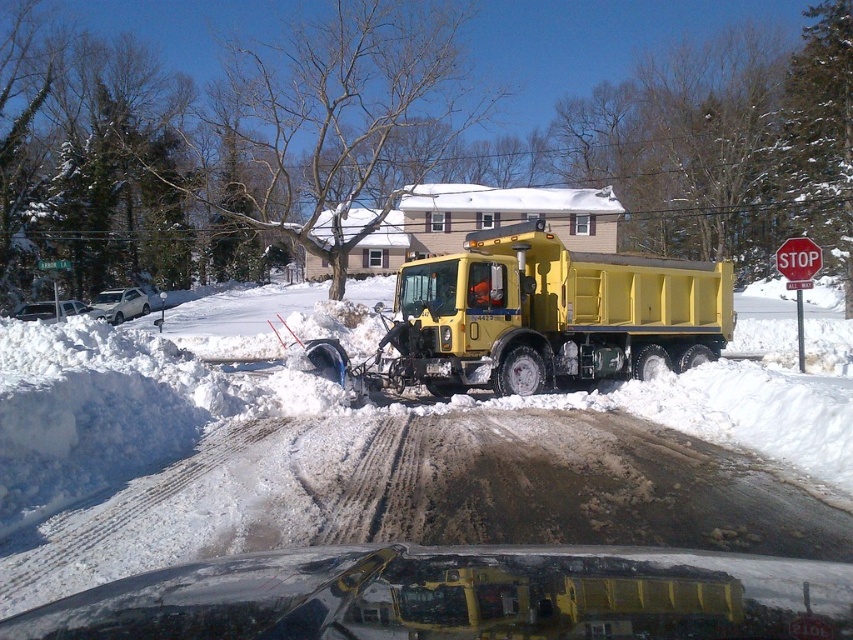
Consider the image. You are standing at the point marked as point [550,314] in the snowy scene. What object are you currently standing on?

You are standing on the yellow matte snowplow at center.